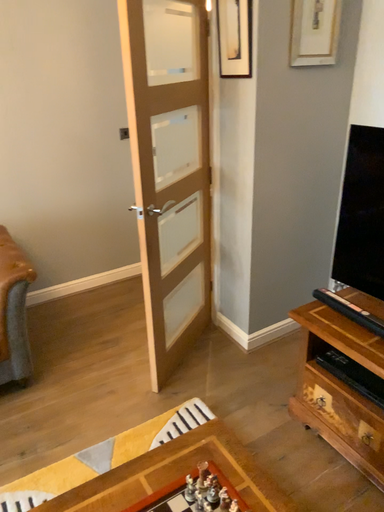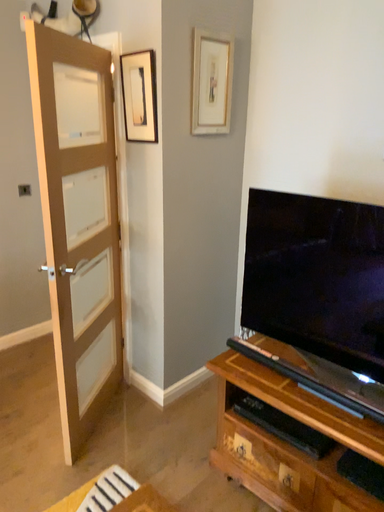
Question: Which way did the camera rotate in the video?

Choices:
 (A) rotated right
 (B) rotated left

Answer: (A)